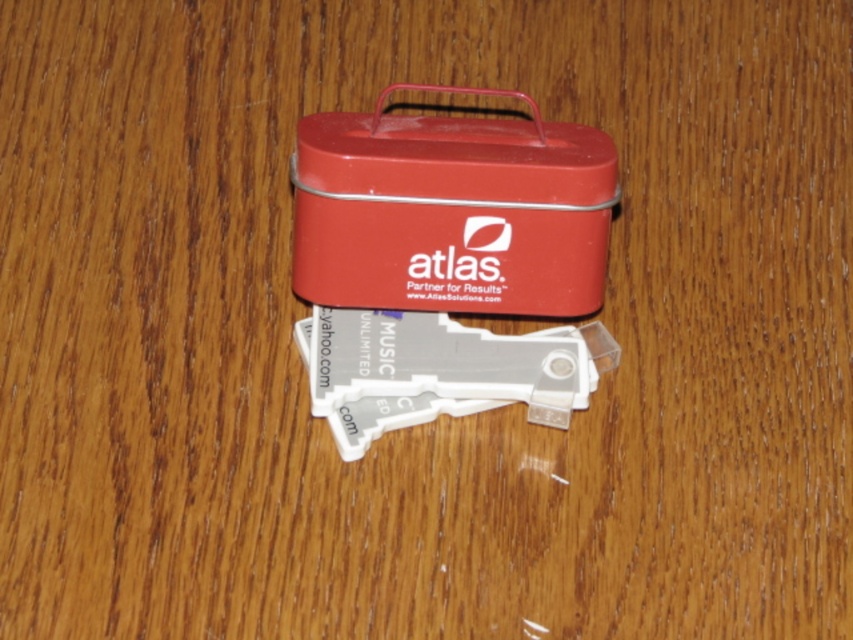
Question: Is matte red tin at center smaller than transparent plastic keychain at center?

Choices:
 (A) no
 (B) yes

Answer: (A)

Question: Is matte red tin at center wider than transparent plastic keychain at center?

Choices:
 (A) no
 (B) yes

Answer: (B)

Question: Can you confirm if matte red tin at center is positioned to the left of transparent plastic keychain at center?

Choices:
 (A) no
 (B) yes

Answer: (B)

Question: Which object appears closest to the camera in this image?

Choices:
 (A) matte red tin at center
 (B) transparent plastic keychain at center

Answer: (A)

Question: Among these objects, which one is nearest to the camera?

Choices:
 (A) transparent plastic keychain at center
 (B) matte red tin at center

Answer: (B)